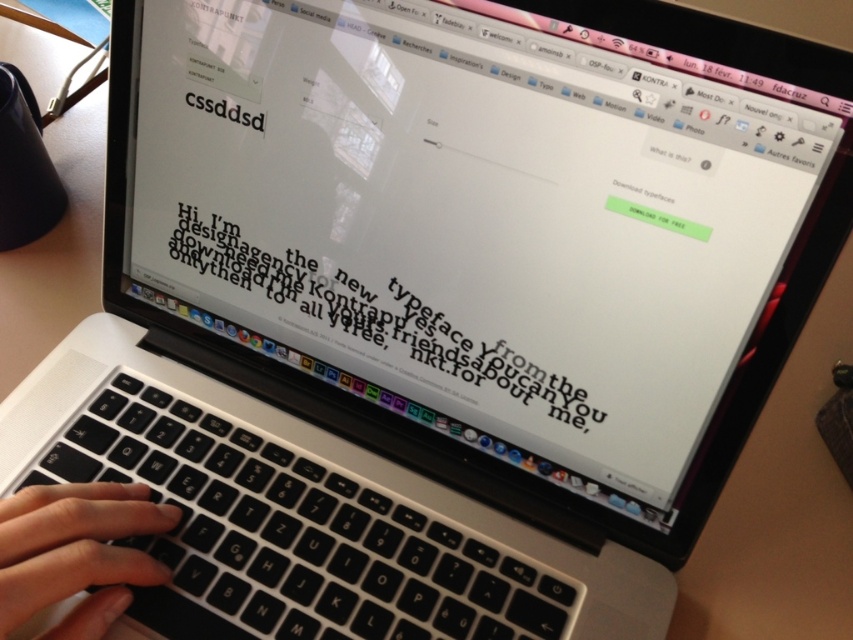
You are a graphic designer working on a project and see the black matte keyboard at center and the black matte hand at center on the laptop screen. Which object is taller in the image?

The black matte keyboard at center is taller than the black matte hand at center.

You are a graphic designer working on a project and need to ensure that your hand can comfortably rest on the keyboard without overlapping. Given the black matte keyboard at center and the black matte hand at center, can your hand fit on the keyboard without overlapping?

The black matte keyboard at center is larger in size than black matte hand at center, so yes, the hand can fit comfortably on the keyboard without overlapping.